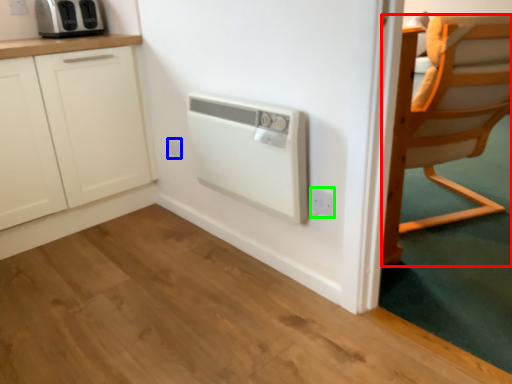
Question: Estimate the real-world distances between objects in this image. Which object is closer to chair (highlighted by a red box), electric outlet (highlighted by a blue box) or electric outlet (highlighted by a green box)?

Choices:
 (A) electric outlet
 (B) electric outlet

Answer: (B)